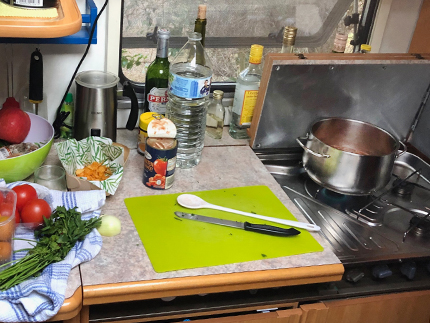
At what (x,y) coordinates should I click in order to perform the action: click on kitchen. Please return your answer as a coordinate pair (x, y). Looking at the image, I should click on (181, 143).